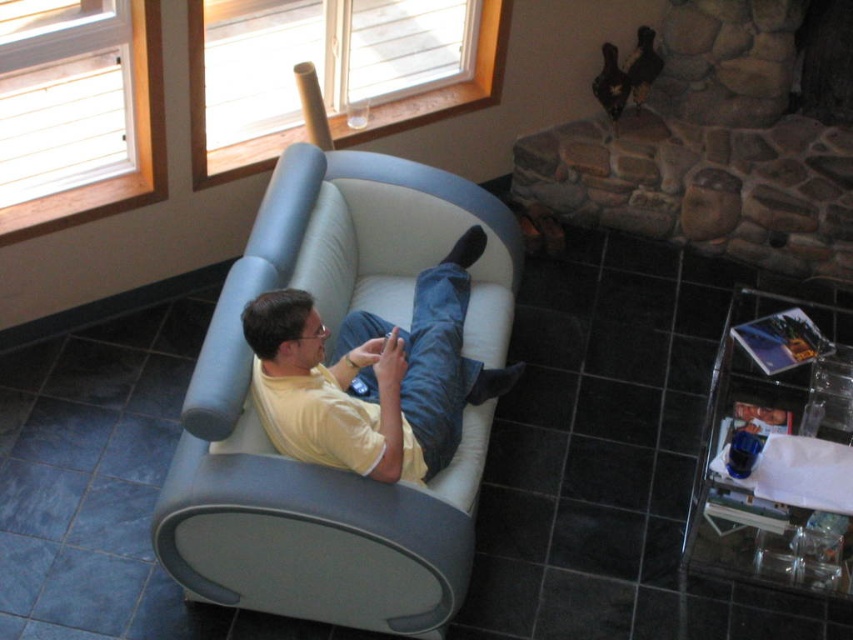
Based on the photo, does matte gray couch at center have a lesser height compared to yellow matte shirt at center?

In fact, matte gray couch at center may be taller than yellow matte shirt at center.

Does point (286, 484) lie in front of point (277, 372)?

That is True.

Find the location of a particular element. The image size is (853, 640). matte gray couch at center is located at coordinates (329, 468).